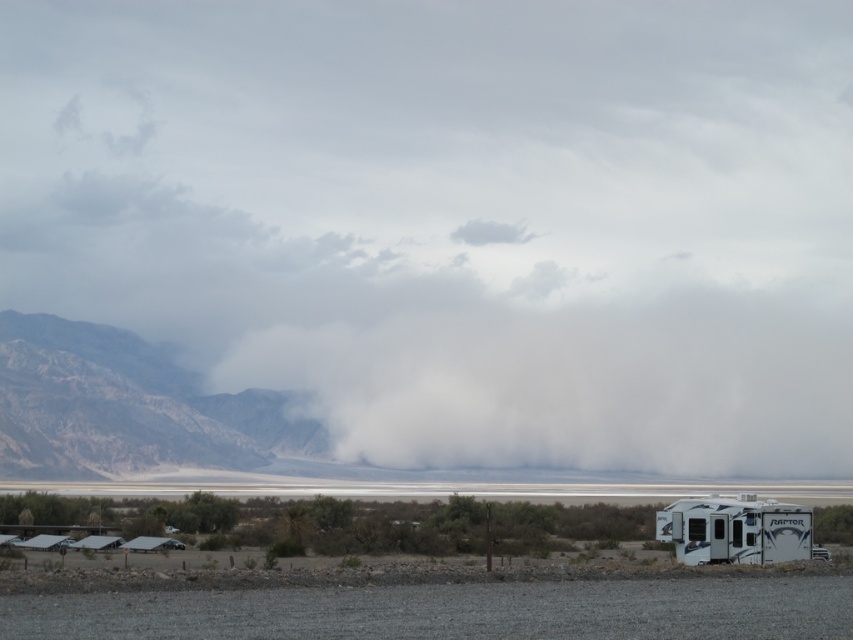
Does rugged brown mountain at left have a greater height compared to white glossy recreational vehicle at lower right?

Yes.

Is rugged brown mountain at left positioned behind white glossy recreational vehicle at lower right?

That is True.

The width and height of the screenshot is (853, 640). Identify the location of rugged brown mountain at left. (125, 406).

Locate an element on the screen. This screenshot has height=640, width=853. rugged brown mountain at left is located at coordinates point(125,406).